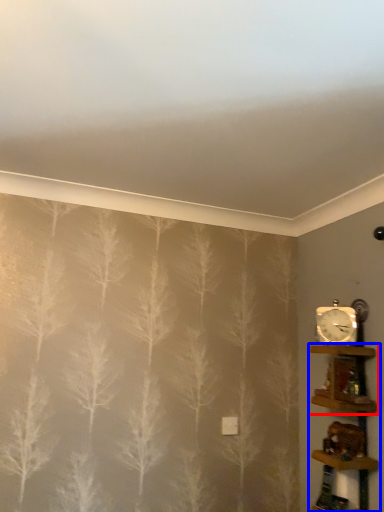
Question: Which point is closer to the camera, shelf (highlighted by a red box) or shelf (highlighted by a blue box)?

Choices:
 (A) shelf
 (B) shelf

Answer: (B)